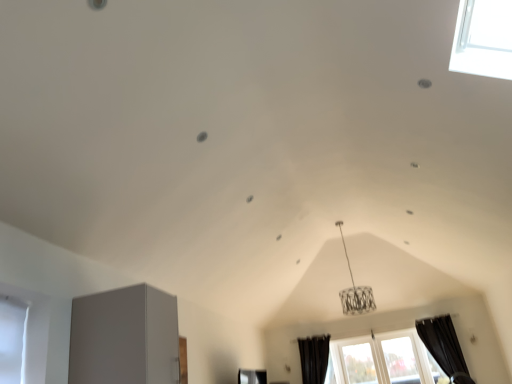
Question: From a real-world perspective, relative to white glass window at lower right, which is the first window from left to right, is transparent glass window at lower right, acting as the first window starting from the right, vertically above or below?

Choices:
 (A) below
 (B) above

Answer: (B)

Question: Considering the positions of point (399, 347) and point (400, 350), is point (399, 347) closer or farther from the camera than point (400, 350)?

Choices:
 (A) farther
 (B) closer

Answer: (A)

Question: Estimate the real-world distances between objects in this image. Which object is farther from the black fabric curtain at lower center, the 1th curtain when ordered from left to right?

Choices:
 (A) white glass window at lower right, which is the first window from left to right
 (B) transparent glass window at lower right, the second window viewed from the left
 (C) black fabric curtain at lower right, the 1th curtain from the right

Answer: (C)

Question: Which is farther from the transparent glass window at lower right, the second window viewed from the left?

Choices:
 (A) white glass window at lower right, which is counted as the second window, starting from the right
 (B) black fabric curtain at lower center, the 1th curtain when ordered from left to right
 (C) black fabric curtain at lower right, the 2th curtain positioned from the left

Answer: (B)